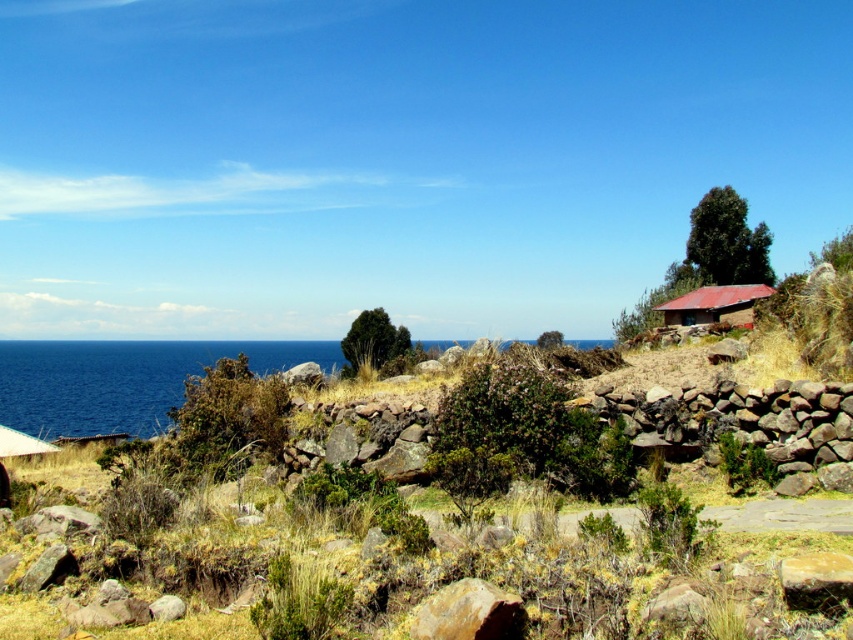
Measure the distance between point (134, 346) and camera.

Point (134, 346) and camera are 265.86 meters apart.

Between blue water at left and brown clay hut at right, which one is positioned lower?

blue water at left is lower down.

The width and height of the screenshot is (853, 640). Identify the location of blue water at left. (123, 380).